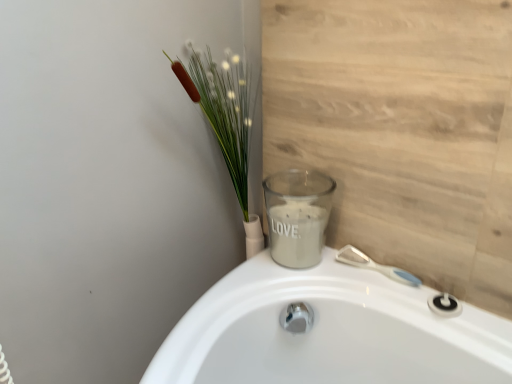
Where is `clear plastic shower head at upper center`? This screenshot has height=384, width=512. clear plastic shower head at upper center is located at coordinates (375, 266).

In order to face clear plastic shower head at upper center, should I rotate leftwards or rightwards?

It's best to rotate right around 15.357 degrees.

Measure the distance between point (384,271) and camera.

Point (384,271) and camera are 1.06 meters apart.

Image resolution: width=512 pixels, height=384 pixels. What do you see at coordinates (375, 266) in the screenshot?
I see `clear plastic shower head at upper center` at bounding box center [375, 266].

Find the location of `clear plastic shower head at upper center`. clear plastic shower head at upper center is located at coordinates (375, 266).